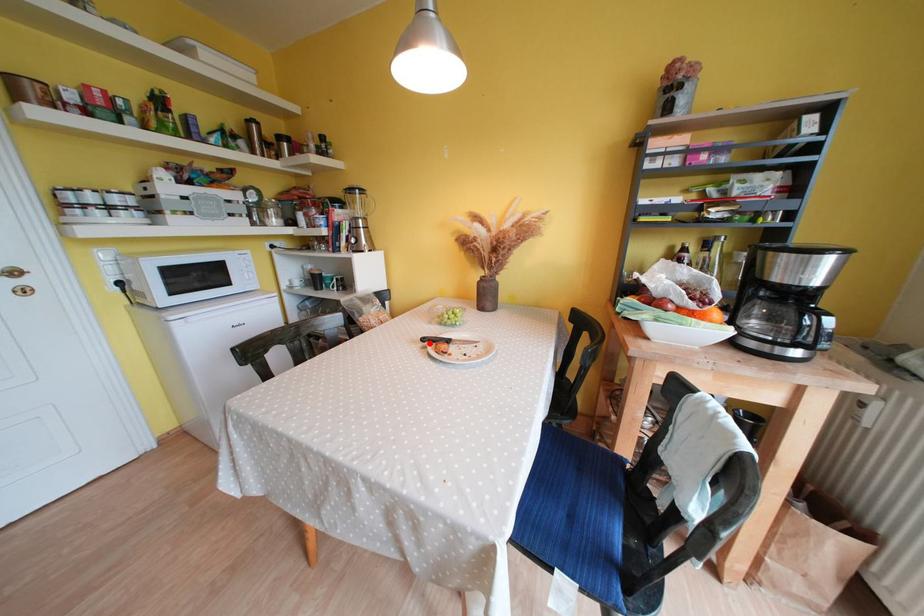
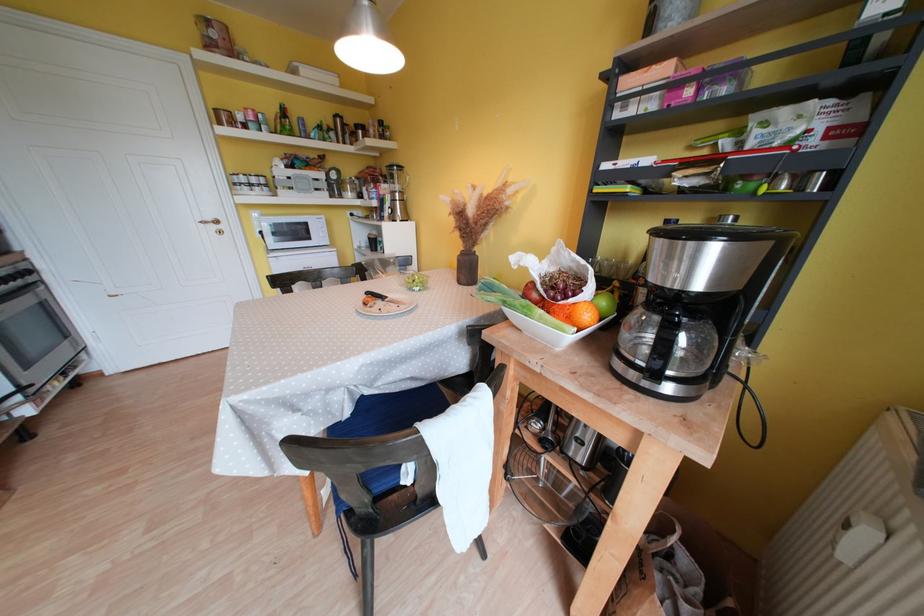
Question: I am providing you with two images of the same scene from different viewpoints. A red point is marked on the first image. Can you still see the location of the red point in image 2?

Choices:
 (A) Yes
 (B) No

Answer: (A)